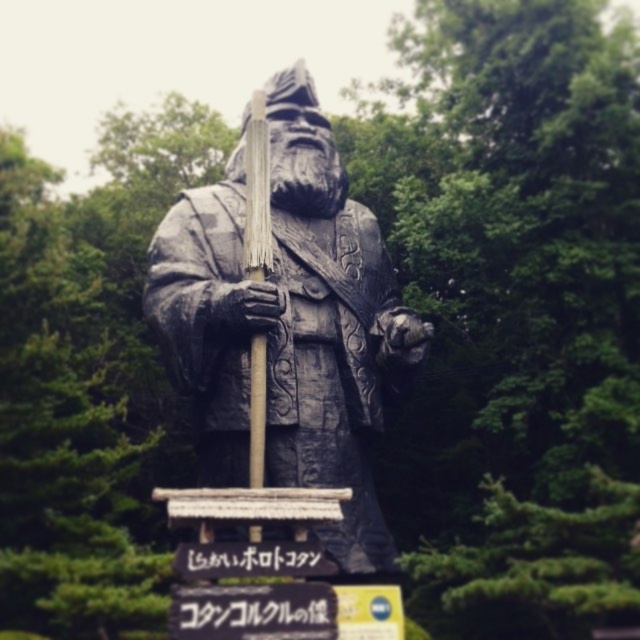
Is bronze statue at center behind black plastic sign at center?

Yes, it is behind black plastic sign at center.

Can you confirm if bronze statue at center is smaller than black plastic sign at center?

No.

Locate an element on the screen. bronze statue at center is located at coordinates (288, 323).